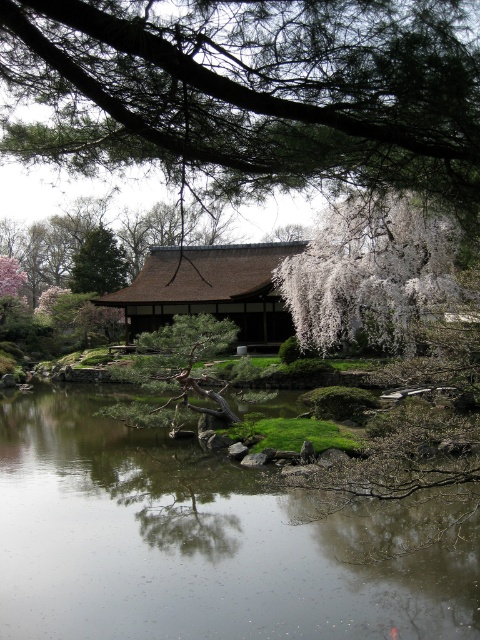
You are a gardener planning to prune both the white blossoming tree at center and the green leafy tree at upper left. Based on their sizes, which tree requires more space when pruning to avoid damaging nearby plants?

The white blossoming tree at center requires more space when pruning because its width is larger than the green leafy tree at upper left.